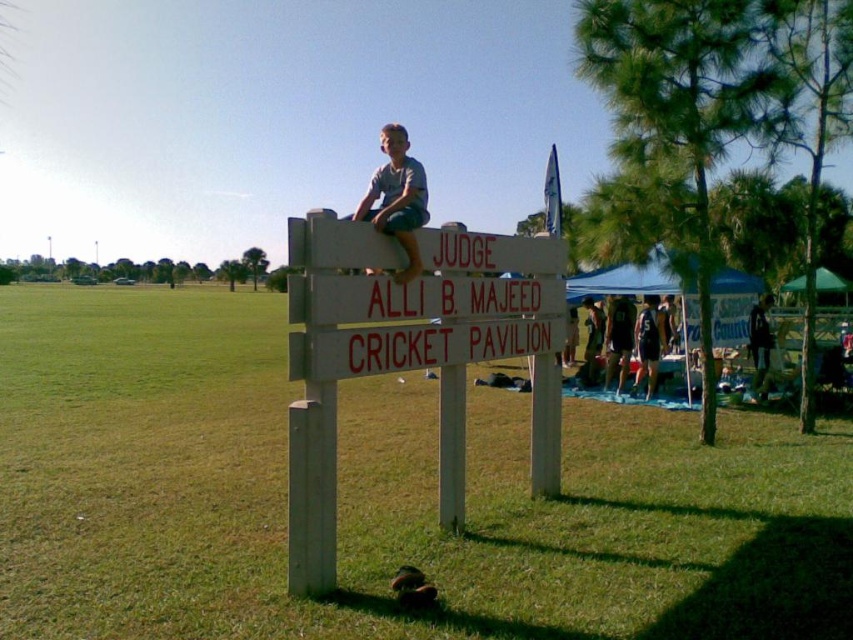
You are a photographer trying to capture a clear shot of the white wood sign at center and the dark blue shirt at center. Which object should you focus on first to ensure both are in focus?

The white wood sign at center is positioned over dark blue shirt at center, so focusing on the white wood sign at center first will ensure both are in focus since it is closer to the camera.

You are a photographer at the cricket pavilion and want to capture both the dark blue jersey at center and the dark blue shirt at center in the same frame. Which one should you adjust your camera to focus on first to ensure both are in the shot?

You should focus on the dark blue jersey at center first since it is to the left of the dark blue shirt at center, allowing you to frame both by adjusting the camera to include both from left to right.

You are standing at the entrance of the JUDGE ALLI B. MAJEED CRICKET PAVILION and see the gray cotton shirt at upper center and the dark blue shirt at center. Which shirt is closer to you?

The gray cotton shirt at upper center is closer to you because it is in front of the dark blue shirt at center.